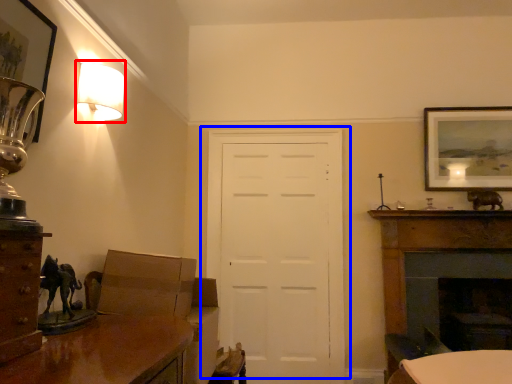
Question: Which of the following is the closest to the observer, lamp (highlighted by a red box) or door (highlighted by a blue box)?

Choices:
 (A) lamp
 (B) door

Answer: (A)